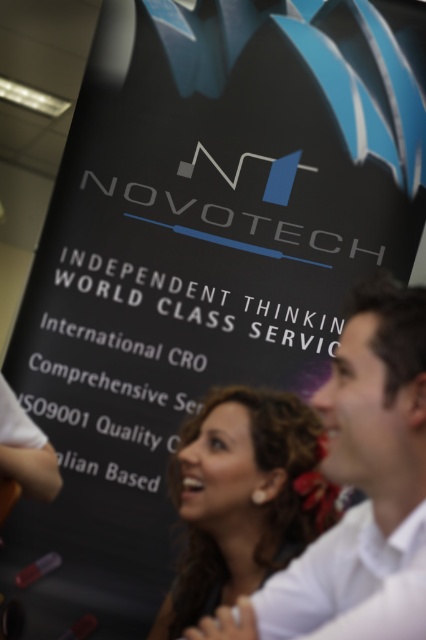
Which of these two, white shirt at center or curly hair at center, stands shorter?

With less height is white shirt at center.

Is point (405, 586) positioned behind point (259, 570)?

No, it is not.

Which is in front, point (348, 317) or point (264, 528)?

Positioned in front is point (348, 317).

Identify the location of white shirt at center. The width and height of the screenshot is (426, 640). (362, 490).